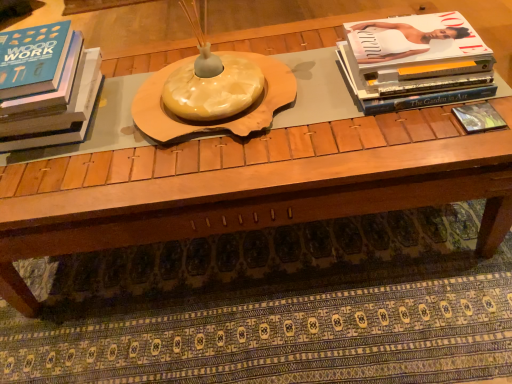
Measure the distance between matte white book at upper right, the 2th book when ordered from right to left, and camera.

matte white book at upper right, the 2th book when ordered from right to left, and camera are 36.22 inches apart from each other.

The image size is (512, 384). I want to click on matte white book at upper right, the 2th book when ordered from right to left, so click(413, 88).

From a real-world perspective, is matte black book at left, which appears as the third book when viewed from the right, above or below matte white book at upper right, the second book positioned from the left?

From a real-world perspective, matte black book at left, which appears as the third book when viewed from the right, is physically above matte white book at upper right, the second book positioned from the left.

Do you think matte black book at left, which appears as the third book when viewed from the right, is within matte white book at upper right, the second book positioned from the left, or outside of it?

matte black book at left, which appears as the third book when viewed from the right, is spatially situated outside matte white book at upper right, the second book positioned from the left.

Considering the relative sizes of matte black book at left, which appears as the third book when viewed from the right, and matte white book at upper right, the second book positioned from the left, in the image provided, is matte black book at left, which appears as the third book when viewed from the right, wider than matte white book at upper right, the second book positioned from the left,?

Yes, matte black book at left, which appears as the third book when viewed from the right, is wider than matte white book at upper right, the second book positioned from the left.

Is matte black book at left, which appears as the third book when viewed from the right, to the right of matte white book at upper right, the second book positioned from the left, from the viewer's perspective?

No.

Which is more to the right, matte black book at right, marked as the third book in a left-to-right arrangement, or matte white book at upper right, the 2th book when ordered from right to left?

matte black book at right, marked as the third book in a left-to-right arrangement, is more to the right.

Consider the image. Is matte black book at right, the first book in the right-to-left sequence, oriented away from matte white book at upper right, the second book positioned from the left?

That's right, matte black book at right, the first book in the right-to-left sequence, is facing away from matte white book at upper right, the second book positioned from the left.

Based on the photo, from the image's perspective, is matte black book at right, marked as the third book in a left-to-right arrangement, located above or below matte white book at upper right, the 2th book when ordered from right to left?

matte black book at right, marked as the third book in a left-to-right arrangement, is situated lower than matte white book at upper right, the 2th book when ordered from right to left, in the image.

How distant is matte black book at right, marked as the third book in a left-to-right arrangement, from matte white book at upper right, the 2th book when ordered from right to left?

matte black book at right, marked as the third book in a left-to-right arrangement, and matte white book at upper right, the 2th book when ordered from right to left, are 4.12 inches apart from each other.

From a real-world perspective, is matte white book at upper right, the second book positioned from the left, under matte black book at right, the first book in the right-to-left sequence?

No.

Is point (365, 91) positioned behind point (486, 108)?

Yes, it is.

Do you think matte white book at upper right, the 2th book when ordered from right to left, is within matte black book at right, the first book in the right-to-left sequence, or outside of it?

matte white book at upper right, the 2th book when ordered from right to left, is not enclosed by matte black book at right, the first book in the right-to-left sequence.

At what (x,y) coordinates should I click in order to perform the action: click on book lying on the right of matte white book at upper right, the second book positioned from the left. Please return your answer as a coordinate pair (x, y). This screenshot has height=384, width=512. Looking at the image, I should click on (478, 117).

From a real-world perspective, is matte white book at upper right, the second book positioned from the left, under matte black book at left, which appears as the third book when viewed from the right?

Yes, from a real-world perspective, matte white book at upper right, the second book positioned from the left, is below matte black book at left, which appears as the third book when viewed from the right.

Looking at their sizes, would you say matte white book at upper right, the 2th book when ordered from right to left, is wider or thinner than matte black book at left, which appears as the third book when viewed from the right?

Clearly, matte white book at upper right, the 2th book when ordered from right to left, has less width compared to matte black book at left, which appears as the third book when viewed from the right.

Considering the positions of objects matte white book at upper right, the 2th book when ordered from right to left, and matte black book at left, acting as the 1th book starting from the left, in the image provided, who is more to the left, matte white book at upper right, the 2th book when ordered from right to left, or matte black book at left, acting as the 1th book starting from the left,?

From the viewer's perspective, matte black book at left, acting as the 1th book starting from the left, appears more on the left side.

Which point is more forward, (x=478, y=124) or (x=44, y=126)?

The point (x=478, y=124) is closer to the camera.

Looking at their sizes, would you say matte black book at right, the first book in the right-to-left sequence, is wider or thinner than matte black book at left, which appears as the third book when viewed from the right?

In the image, matte black book at right, the first book in the right-to-left sequence, appears to be more narrow than matte black book at left, which appears as the third book when viewed from the right.

Is matte black book at right, the first book in the right-to-left sequence, to the right of matte black book at left, acting as the 1th book starting from the left, from the viewer's perspective?

Yes.

From a real-world perspective, is matte black book at left, acting as the 1th book starting from the left, above or below matte black book at right, the first book in the right-to-left sequence?

From a real-world perspective, matte black book at left, acting as the 1th book starting from the left, is physically above matte black book at right, the first book in the right-to-left sequence.

Does matte black book at left, which appears as the third book when viewed from the right, have a greater height compared to matte black book at right, marked as the third book in a left-to-right arrangement?

Correct, matte black book at left, which appears as the third book when viewed from the right, is much taller as matte black book at right, marked as the third book in a left-to-right arrangement.

From the image's perspective, which is above, matte black book at left, which appears as the third book when viewed from the right, or matte black book at right, the first book in the right-to-left sequence?

matte black book at left, which appears as the third book when viewed from the right, appears higher in the image.

Is matte black book at left, which appears as the third book when viewed from the right, smaller than matte black book at right, the first book in the right-to-left sequence?

No.

You are a GUI agent. You are given a task and a screenshot of the screen. Output one action in this format:
    pyautogui.click(x=<x>, y=<y>)
    Task: Click on the book on the left of the matte white book at upper right, the 2th book when ordered from right to left
    The width and height of the screenshot is (512, 384).
    Given the screenshot: What is the action you would take?
    click(55, 105)

From a real-world perspective, count 1st books upward from the matte black book at right, the first book in the right-to-left sequence, and point to it. Please provide its 2D coordinates.

[(413, 88)]

Which object lies nearer to the anchor point matte black book at right, marked as the third book in a left-to-right arrangement, matte white book at upper right, the second book positioned from the left, or matte black book at left, which appears as the third book when viewed from the right?

matte white book at upper right, the second book positioned from the left, is closer to matte black book at right, marked as the third book in a left-to-right arrangement.

When comparing their distances from matte white book at upper right, the 2th book when ordered from right to left, does matte black book at right, marked as the third book in a left-to-right arrangement, or matte black book at left, which appears as the third book when viewed from the right, seem further?

matte black book at left, which appears as the third book when viewed from the right, is further to matte white book at upper right, the 2th book when ordered from right to left.

Which object lies further to the anchor point matte black book at left, which appears as the third book when viewed from the right, matte black book at right, marked as the third book in a left-to-right arrangement, or matte white book at upper right, the 2th book when ordered from right to left?

The object further to matte black book at left, which appears as the third book when viewed from the right, is matte black book at right, marked as the third book in a left-to-right arrangement.

When comparing their distances from matte white book at upper right, the 2th book when ordered from right to left, does matte black book at left, acting as the 1th book starting from the left, or matte black book at right, the first book in the right-to-left sequence, seem further?

Among the two, matte black book at left, acting as the 1th book starting from the left, is located further to matte white book at upper right, the 2th book when ordered from right to left.

Looking at the image, which one is located closer to matte black book at right, marked as the third book in a left-to-right arrangement, matte black book at left, which appears as the third book when viewed from the right, or matte white book at upper right, the second book positioned from the left?

Among the two, matte white book at upper right, the second book positioned from the left, is located nearer to matte black book at right, marked as the third book in a left-to-right arrangement.

Considering their positions, is matte white book at upper right, the second book positioned from the left, positioned further to matte black book at left, acting as the 1th book starting from the left, than matte black book at right, the first book in the right-to-left sequence?

matte black book at right, the first book in the right-to-left sequence, is further to matte black book at left, acting as the 1th book starting from the left.

At what (x,y) coordinates should I click in order to perform the action: click on book between matte black book at left, acting as the 1th book starting from the left, and matte black book at right, marked as the third book in a left-to-right arrangement, in the horizontal direction. Please return your answer as a coordinate pair (x, y). Looking at the image, I should click on (413, 88).